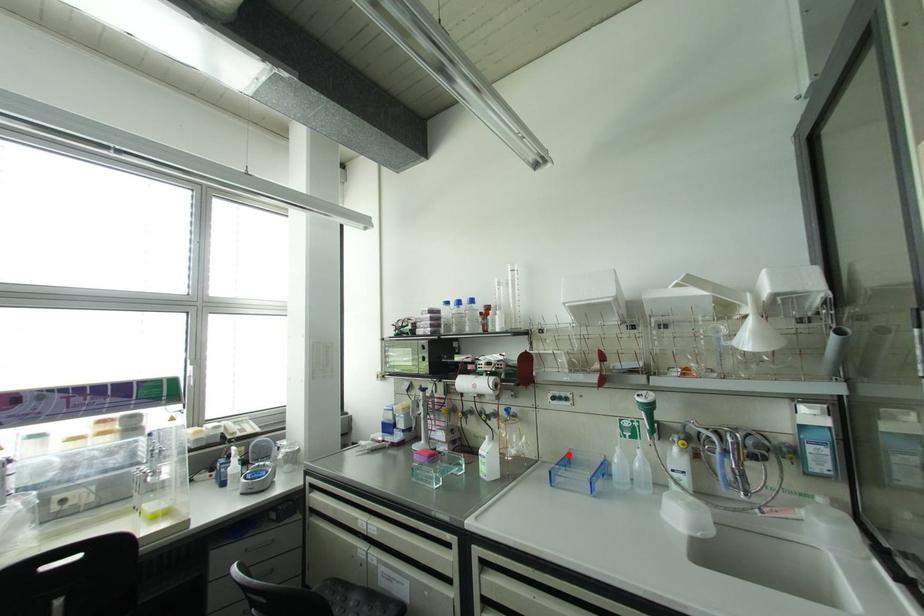
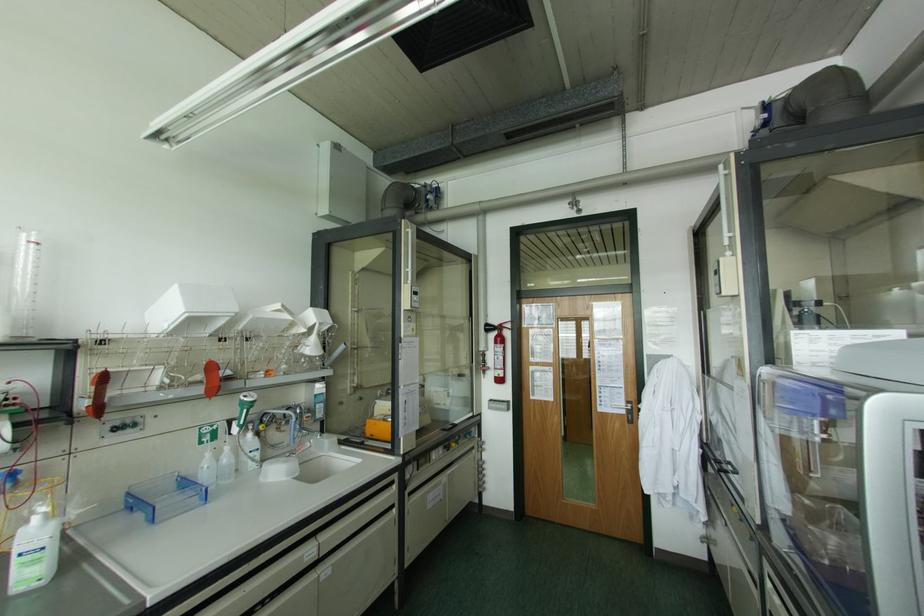
Question: I am providing you with two images of the same scene from different viewpoints. Given a red point in image1, look at the same physical point in image2. Is it:

Choices:
 (A) Closer to the viewpoint
 (B) Farther from the viewpoint

Answer: (A)